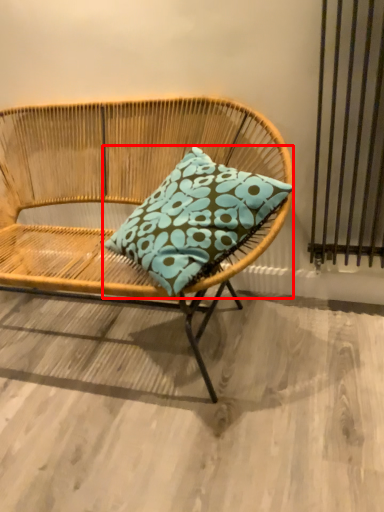
Question: From the image's perspective, where is pillow (annotated by the red box) located in relation to chair in the image?

Choices:
 (A) below
 (B) above

Answer: (B)